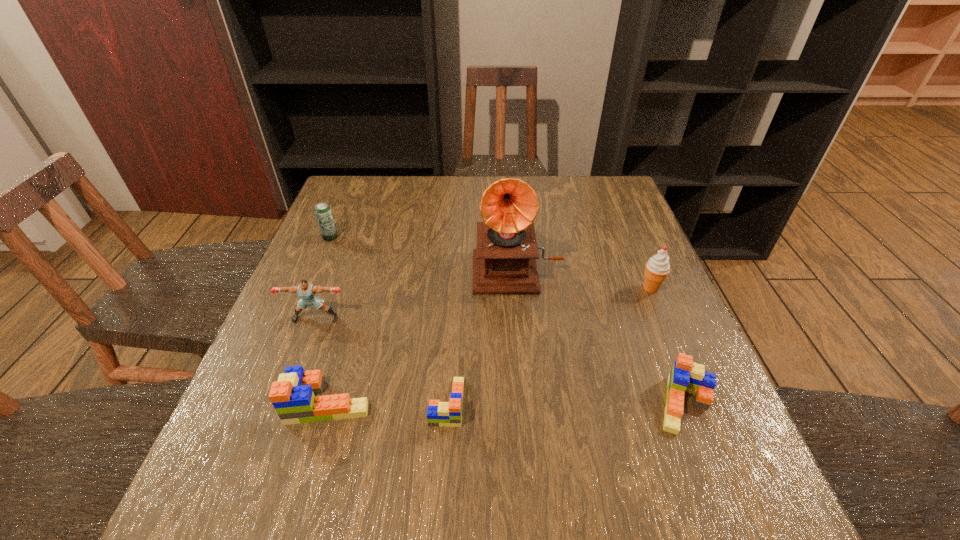
Find the location of a particular element. The width and height of the screenshot is (960, 540). vacant space situated on the back of the tallest Lego is located at coordinates (361, 291).

What are the coordinates of `vacant area situated 0.380m on the back of the shortest object` in the screenshot? It's located at (456, 259).

Find the location of a particular element. This screenshot has height=540, width=960. vacant space situated on the left of the second shortest object is located at coordinates (528, 404).

Locate an element on the screen. This screenshot has width=960, height=540. vacant space located on the right of the beer can is located at coordinates (431, 237).

This screenshot has width=960, height=540. What are the coordinates of `free space located on the horn of the tallest object` in the screenshot? It's located at (529, 391).

Where is `vacant space located on the front-facing side of the fourth nearest object`? The height and width of the screenshot is (540, 960). vacant space located on the front-facing side of the fourth nearest object is located at coordinates (296, 371).

At what (x,y) coordinates should I click in order to perform the action: click on blank space located on the left of the icecream. Please return your answer as a coordinate pair (x, y). The image size is (960, 540). Looking at the image, I should click on tap(578, 288).

Locate an element on the screen. The height and width of the screenshot is (540, 960). Lego located in the left edge section of the desktop is located at coordinates (292, 396).

Where is `beer can positioned at the left edge`? The height and width of the screenshot is (540, 960). beer can positioned at the left edge is located at coordinates (323, 213).

Identify the location of puncher that is at the left edge. The width and height of the screenshot is (960, 540). (306, 291).